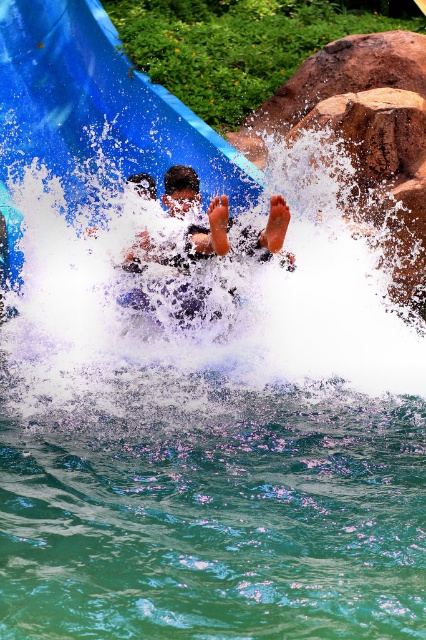
Consider the image. You are standing at the base of the water slide and want to locate two specific points marked in the image. The first point is at coordinates point (51,40) and the second is at point (262,259). Which of these two points is closer to the water slide?

Point (262,259) is closer to the water slide because it is in front of point (51,40).

You are a lifeguard at the water park and need to ensure safety. Since the blue plastic slide at upper left is positioned over the smooth skin person at center, what potential hazard might you need to address?

The blue plastic slide at upper left is positioned over the smooth skin person at center, which could pose a hazard if the person is directly under the slide where they might be hit by sliding individuals or debris.

You are at the water park and want to take a photo of the blue plastic slide at upper left and the smooth skin person at center. Which object should you focus on first if you want both to be in the same frame?

You should focus on the blue plastic slide at upper left first because the smooth skin person at center is behind it, ensuring both are in the same frame by focusing on the foreground object.